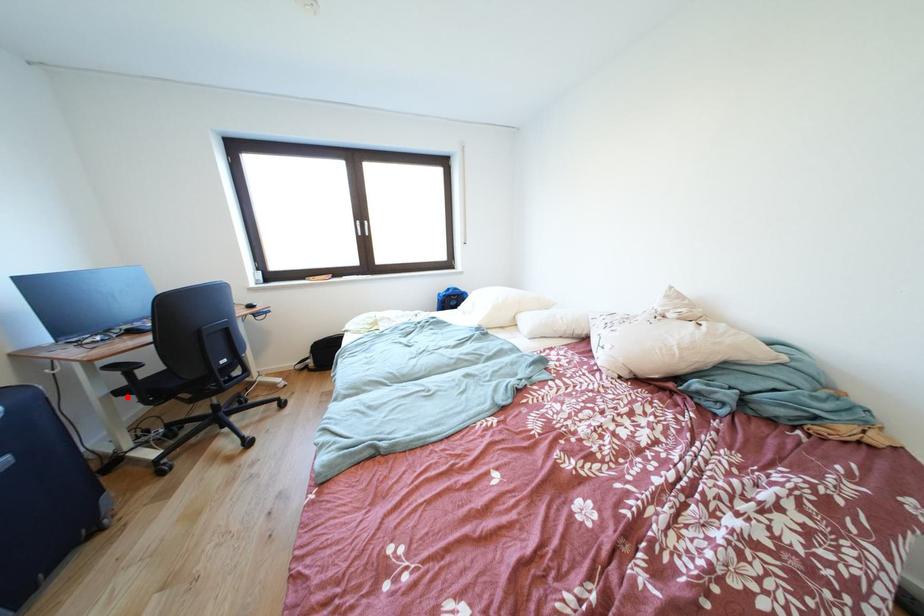
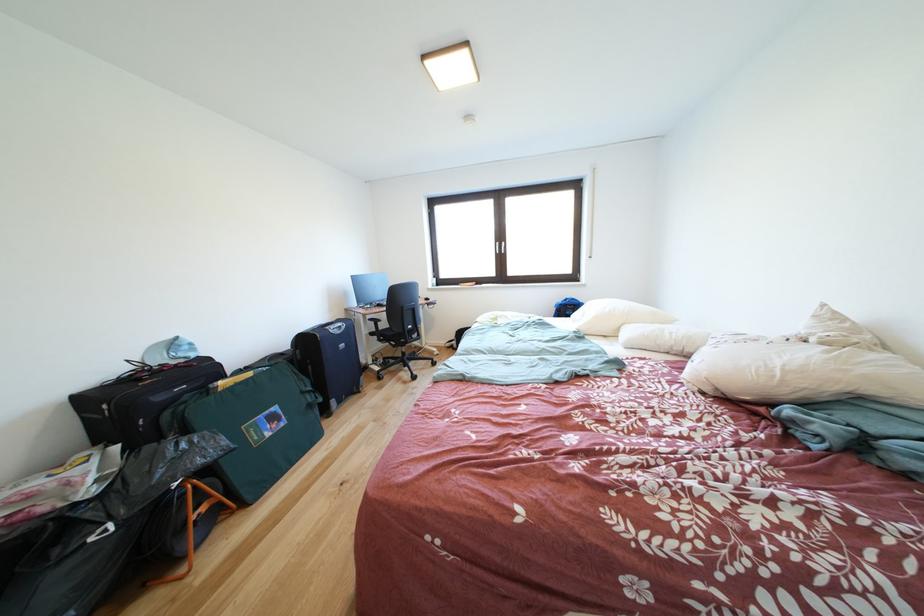
Locate, in the second image, the point that corresponds to the highlighted location in the first image.

(380, 339)